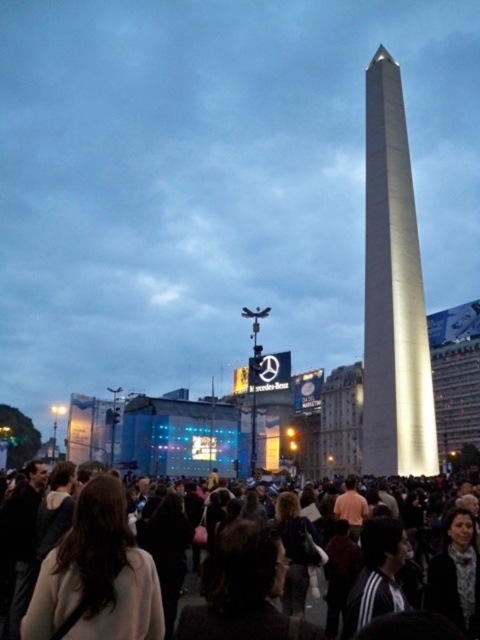
You are a photographer trying to capture both the shiny metallic obelisk at center and the dark brown hair at center in a single shot. Based on their sizes in the image, which object should you focus on first to ensure both are in frame?

The shiny metallic obelisk at center is smaller than the dark brown hair at center, so you should focus on the dark brown hair at center first to ensure both fit in the frame.